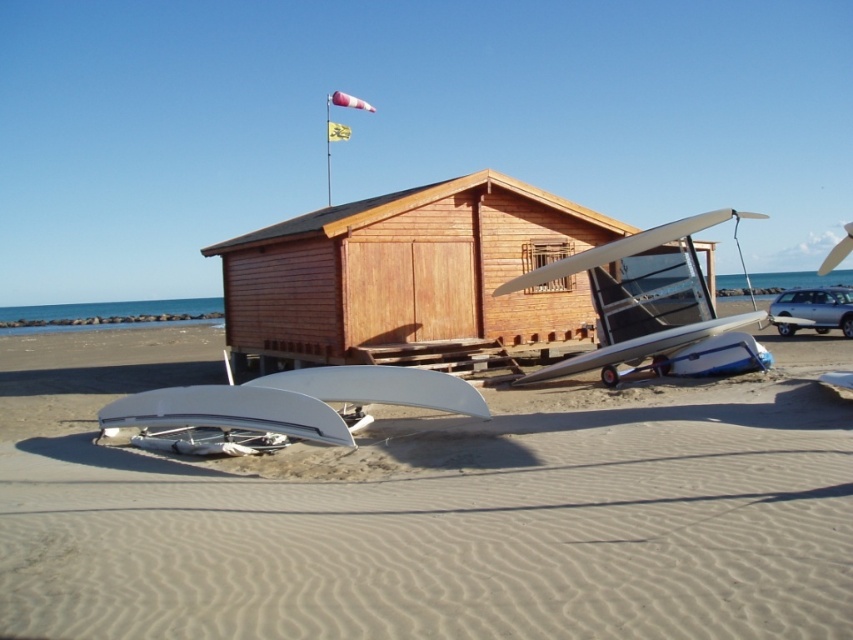
You are planning to transport both the white matte surfboard at center and the metallic silver airplane at center in a truck that has a maximum width capacity of 2 meters. Based on their sizes, which item can fit within the truck without exceeding the width limit?

The white matte surfboard at center has a width less than the metallic silver airplane at center. Since the truck can carry up to 2 meters, both items might fit, but the surfboard definitely fits within the limit. However, the airplane might exceed it depending on its exact width. Without knowing the exact width of the airplane, we can only confirm the surfboard fits.

You are standing on the beach and see the white matte surfboard at center and the metallic silver airplane at center. Which object is closer to the left side of the beach?

The white matte surfboard at center is positioned on the left side of the metallic silver airplane at center, so it is closer to the left side of the beach.

You are a photographer trying to capture both the white matte surfboard at center and the metallic silver airplane at center in a single shot. Given that your camera has a maximum focus range of 15 feet, will you be able to include both objects in focus without moving your position?

The white matte surfboard at center and the metallic silver airplane at center are 17.16 feet apart from each other. Since the distance between them exceeds the camera maximum focus range of 15 feet, you won not be able to include both objects in focus without moving your position.